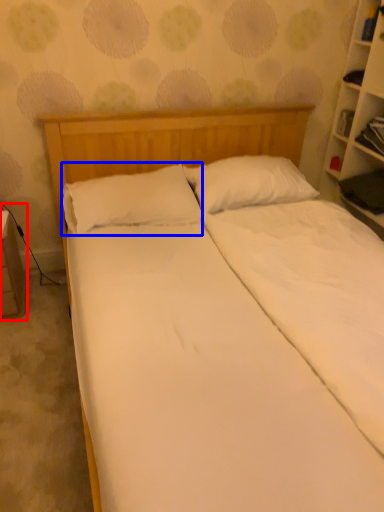
Question: Which of the following is the closest to the observer, table (highlighted by a red box) or pillow (highlighted by a blue box)?

Choices:
 (A) table
 (B) pillow

Answer: (B)